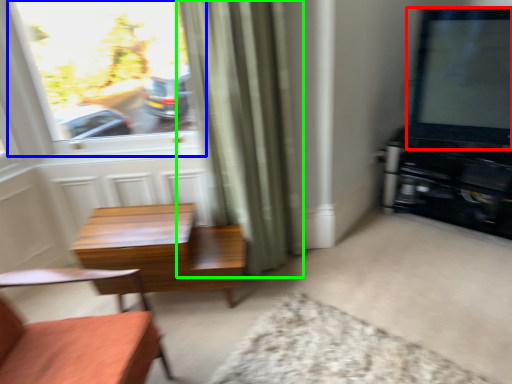
Question: Which is farther away from window screen (highlighted by a red box)? window (highlighted by a blue box) or curtain (highlighted by a green box)?

Choices:
 (A) window
 (B) curtain

Answer: (A)